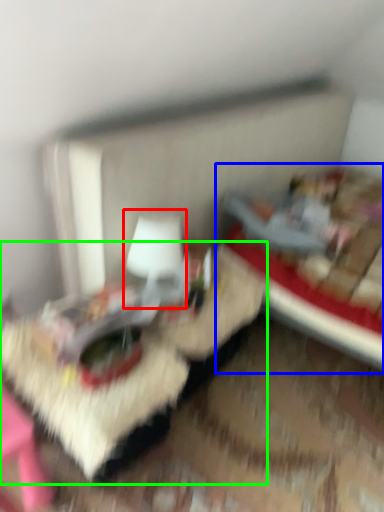
Question: Estimate the real-world distances between objects in this image. Which object is closer to table lamp (highlighted by a red box), bed (highlighted by a blue box) or table (highlighted by a green box)?

Choices:
 (A) bed
 (B) table

Answer: (B)